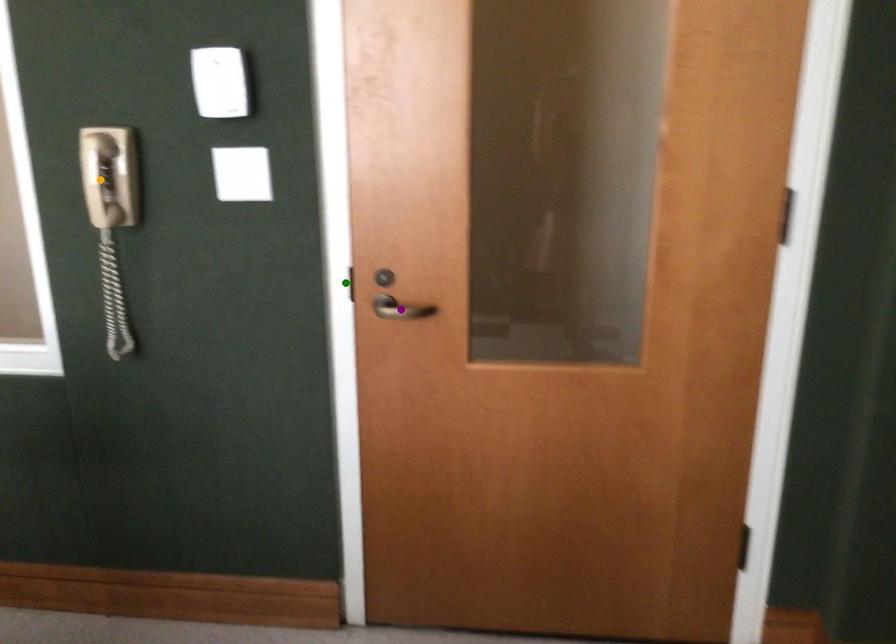
Order these from nearest to farthest:
orange point
purple point
green point

orange point, purple point, green point